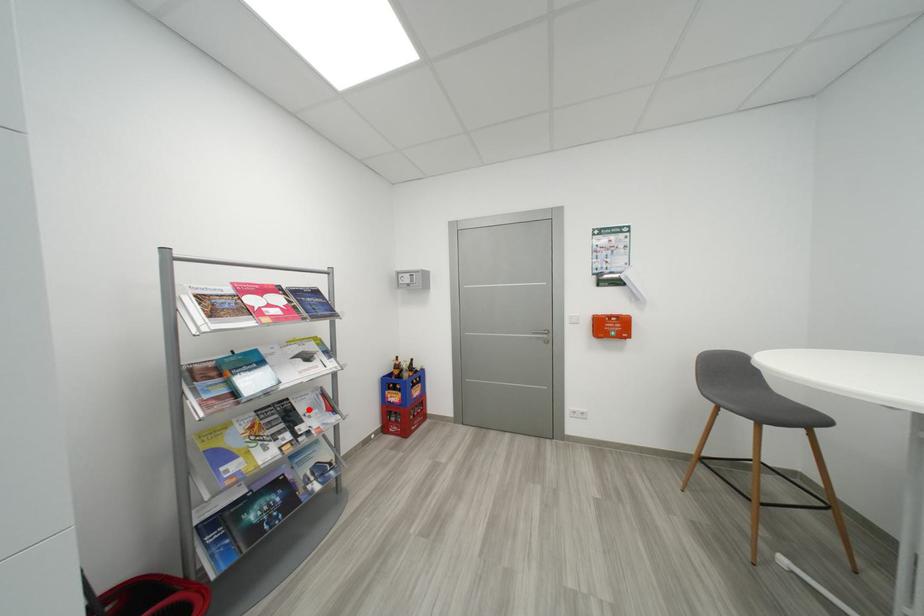
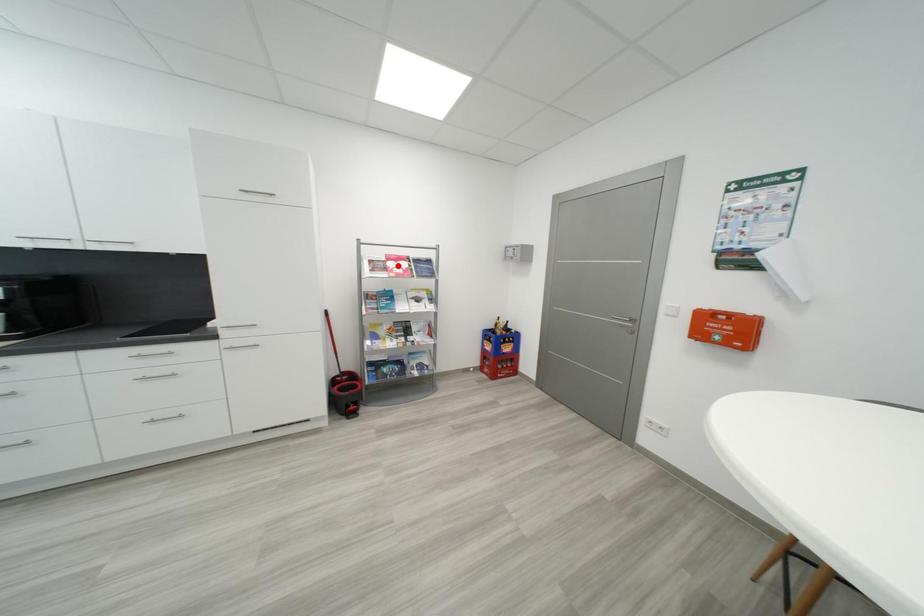
I am providing you with two images of the same scene from different viewpoints. A red point is marked on the first image and another point is marked on the second image. Do the highlighted points in image1 and image2 indicate the same real-world spot?

No